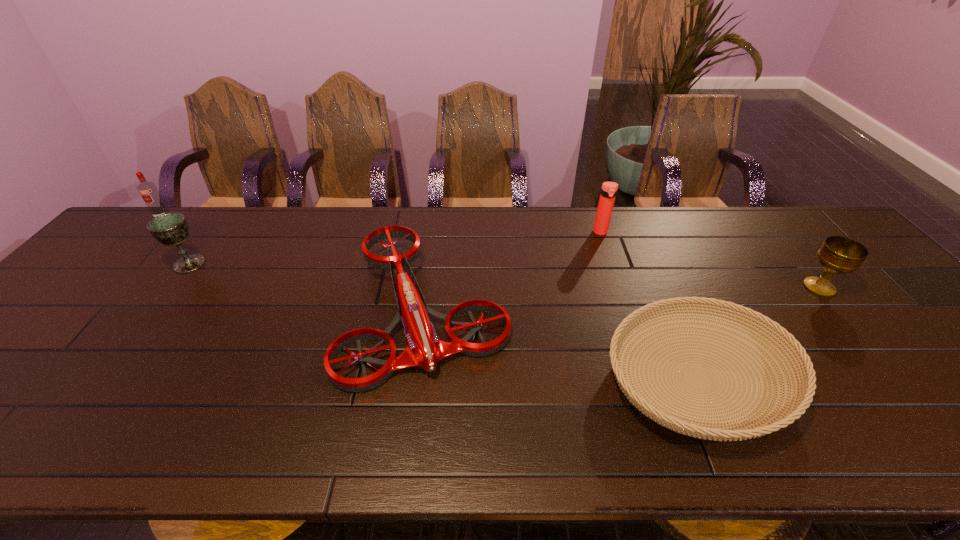
This screenshot has width=960, height=540. In order to click on vacant space in between the leftmost object and the rightmost object in this screenshot , I will do `click(491, 252)`.

Identify the location of free space between the rightmost object and the leftmost object. (491, 252).

The image size is (960, 540). In order to click on free spot between the farther chalice and the second shortest object in this screenshot , I will do `click(308, 287)`.

Locate an element on the screen. Image resolution: width=960 pixels, height=540 pixels. free area in between the left chalice and the basket is located at coordinates click(x=444, y=322).

Locate which object is the closest to the fifth nearest object. Please provide its 2D coordinates. Your answer should be formatted as a tuple, i.e. [(x, y)], where the tuple contains the x and y coordinates of a point satisfying the conditions above.

[(424, 349)]

Locate which object ranks second in proximity to the second farthest object. Please provide its 2D coordinates. Your answer should be formatted as a tuple, i.e. [(x, y)], where the tuple contains the x and y coordinates of a point satisfying the conditions above.

[(796, 405)]

Locate an element on the screen. vacant point that satisfies the following two spatial constraints: 1. on the back side of the fifth nearest object; 2. on the right side of the fifth object from right to left is located at coordinates (213, 233).

The height and width of the screenshot is (540, 960). Find the location of `free space in the image that satisfies the following two spatial constraints: 1. on the front label of the leftmost object; 2. on the right side of the fifth object from right to left`. free space in the image that satisfies the following two spatial constraints: 1. on the front label of the leftmost object; 2. on the right side of the fifth object from right to left is located at coordinates (119, 264).

Where is `blank space that satisfies the following two spatial constraints: 1. on the front label of the farthest object; 2. on the left side of the fifth tallest object`? The image size is (960, 540). blank space that satisfies the following two spatial constraints: 1. on the front label of the farthest object; 2. on the left side of the fifth tallest object is located at coordinates (76, 309).

Where is `vacant space that satisfies the following two spatial constraints: 1. on the front label of the leftmost object; 2. on the left side of the basket`? The width and height of the screenshot is (960, 540). vacant space that satisfies the following two spatial constraints: 1. on the front label of the leftmost object; 2. on the left side of the basket is located at coordinates pyautogui.click(x=11, y=380).